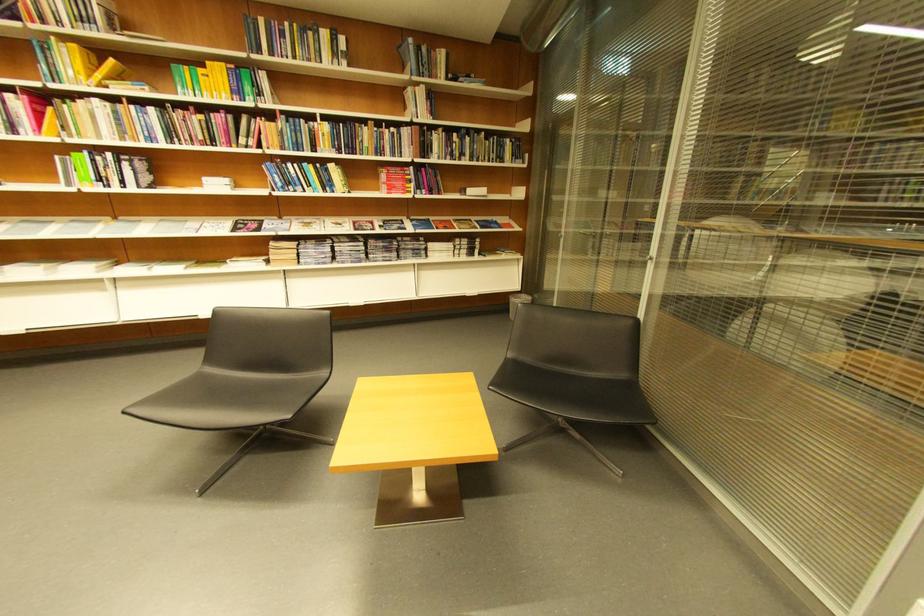
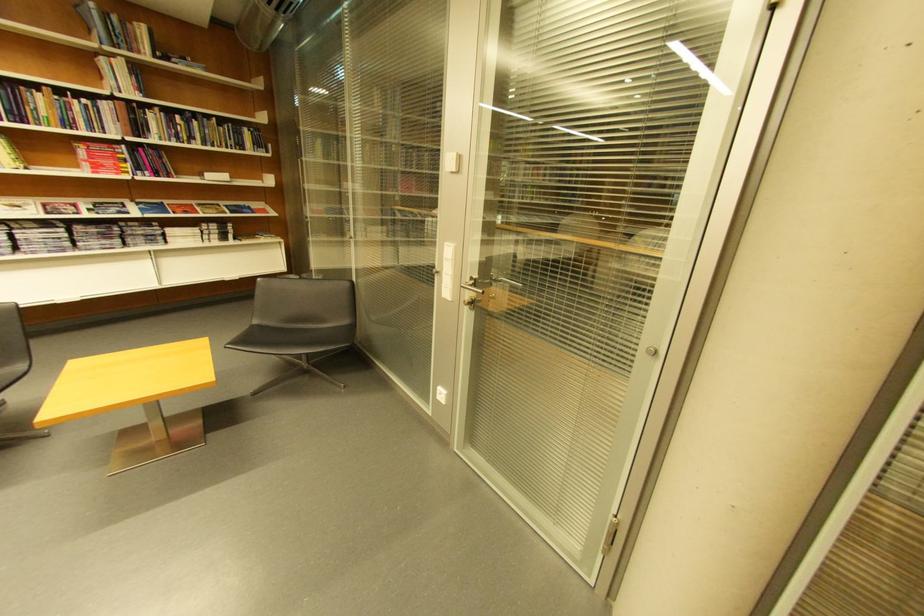
The point at (419, 91) is marked in the first image. Where is the corresponding point in the second image?

(113, 62)